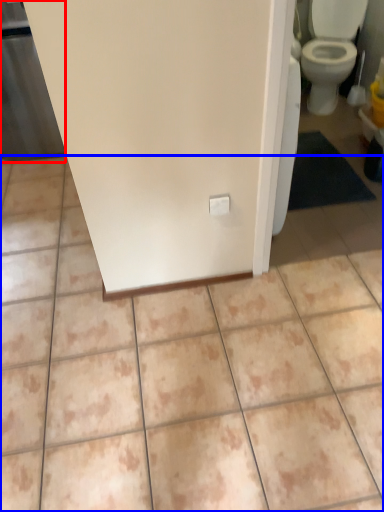
Question: Which object is closer to the camera taking this photo, screen door (highlighted by a red box) or ceramic tile (highlighted by a blue box)?

Choices:
 (A) screen door
 (B) ceramic tile

Answer: (B)